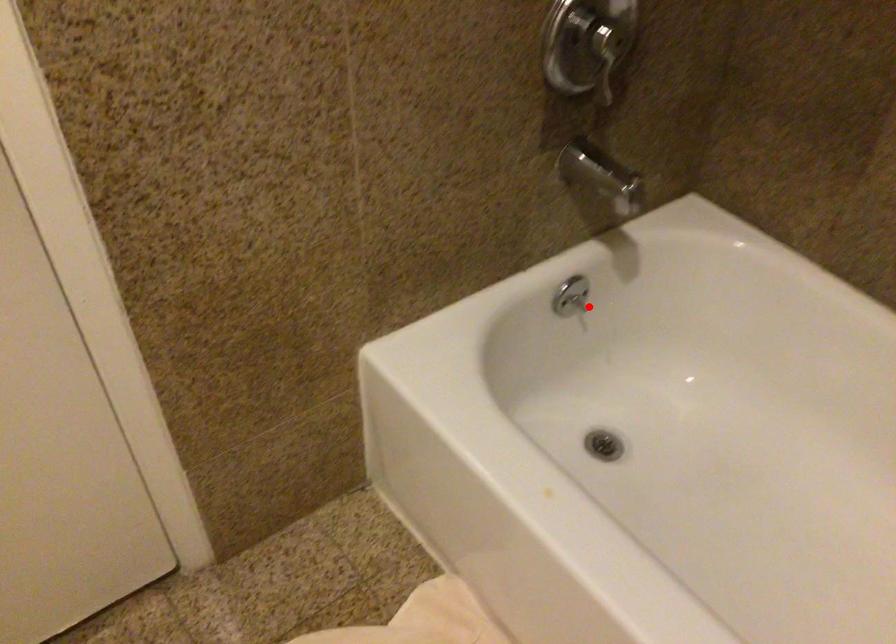
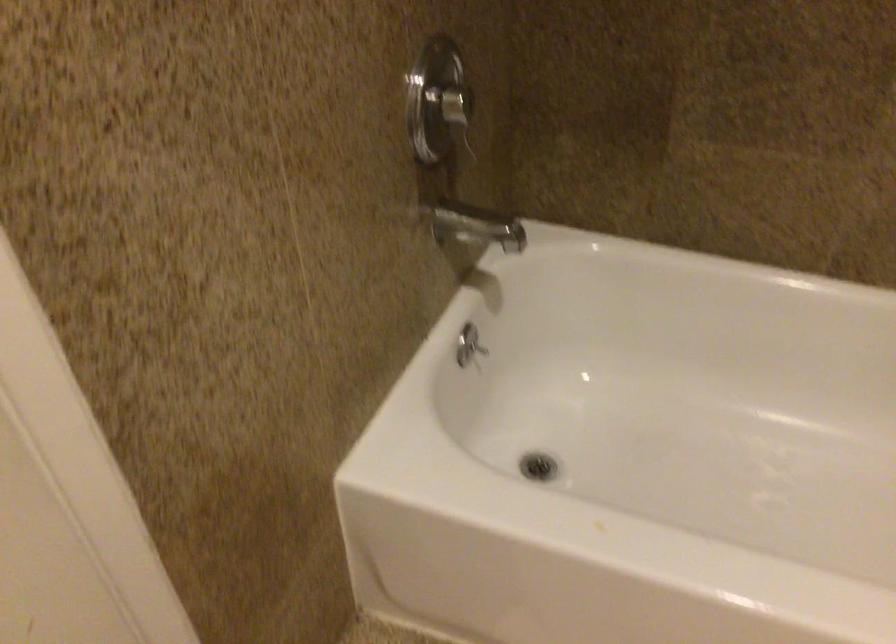
Locate, in the second image, the point that corresponds to the highlighted location in the first image.

(478, 348)